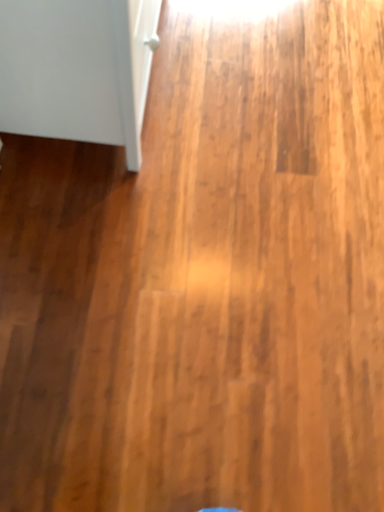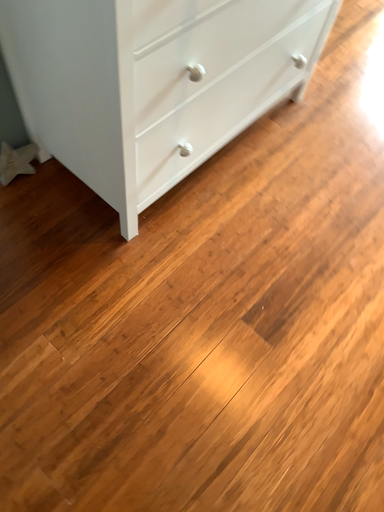
Question: How did the camera likely rotate when shooting the video?

Choices:
 (A) rotated downward
 (B) rotated upward

Answer: (B)